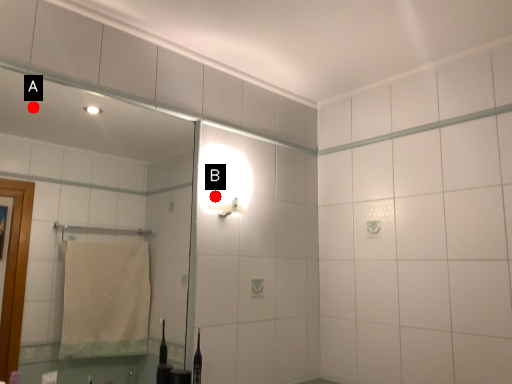
Question: Two points are circled on the image, labeled by A and B beside each circle. Among these points, which one is farthest from the camera?

Choices:
 (A) A is further
 (B) B is further

Answer: (A)